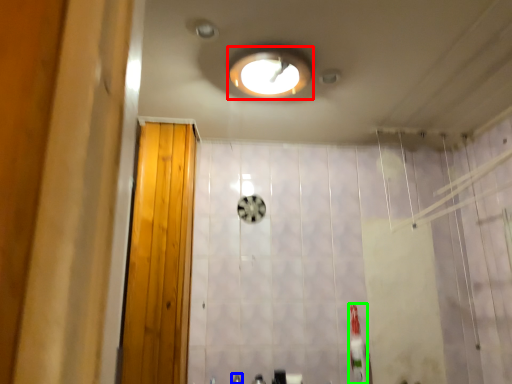
Question: Which object is positioned closest to light fixture (highlighted by a red box)? Select from faucet (highlighted by a blue box) and toothbrush (highlighted by a green box).

Choices:
 (A) faucet
 (B) toothbrush

Answer: (B)